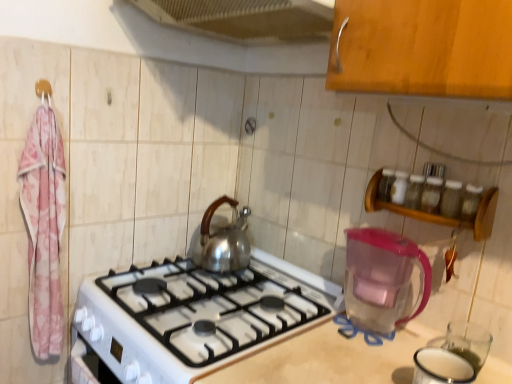
Question: Is transparent plastic pitcher at lower right a part of metallic mesh at upper center?

Choices:
 (A) no
 (B) yes

Answer: (A)

Question: Is metallic mesh at upper center wider than transparent plastic pitcher at lower right?

Choices:
 (A) yes
 (B) no

Answer: (A)

Question: From a real-world perspective, does metallic mesh at upper center stand above transparent plastic pitcher at lower right?

Choices:
 (A) yes
 (B) no

Answer: (A)

Question: From the image's perspective, would you say metallic mesh at upper center is shown under transparent plastic pitcher at lower right?

Choices:
 (A) yes
 (B) no

Answer: (B)

Question: Does metallic mesh at upper center lie in front of transparent plastic pitcher at lower right?

Choices:
 (A) yes
 (B) no

Answer: (A)

Question: Considering the relative positions of transparent plastic pitcher at lower right and wooden spice rack at upper right in the image provided, is transparent plastic pitcher at lower right to the left or to the right of wooden spice rack at upper right?

Choices:
 (A) right
 (B) left

Answer: (B)

Question: Is transparent plastic pitcher at lower right taller or shorter than wooden spice rack at upper right?

Choices:
 (A) short
 (B) tall

Answer: (B)

Question: Is transparent plastic pitcher at lower right inside or outside of wooden spice rack at upper right?

Choices:
 (A) outside
 (B) inside

Answer: (A)

Question: From a real-world perspective, relative to wooden spice rack at upper right, is transparent plastic pitcher at lower right vertically above or below?

Choices:
 (A) above
 (B) below

Answer: (B)

Question: Considering the positions of transparent plastic pitcher at lower right and pink fabric hanger at upper left in the image, is transparent plastic pitcher at lower right bigger or smaller than pink fabric hanger at upper left?

Choices:
 (A) big
 (B) small

Answer: (A)

Question: From the image's perspective, is transparent plastic pitcher at lower right above or below pink fabric hanger at upper left?

Choices:
 (A) below
 (B) above

Answer: (A)

Question: Would you say transparent plastic pitcher at lower right is inside or outside pink fabric hanger at upper left?

Choices:
 (A) inside
 (B) outside

Answer: (B)

Question: Is transparent plastic pitcher at lower right taller or shorter than pink fabric hanger at upper left?

Choices:
 (A) tall
 (B) short

Answer: (A)

Question: Based on their sizes in the image, would you say pink fabric hanger at upper left is bigger or smaller than wooden spice rack at upper right?

Choices:
 (A) big
 (B) small

Answer: (B)

Question: Considering the positions of pink fabric hanger at upper left and wooden spice rack at upper right in the image, is pink fabric hanger at upper left taller or shorter than wooden spice rack at upper right?

Choices:
 (A) tall
 (B) short

Answer: (B)